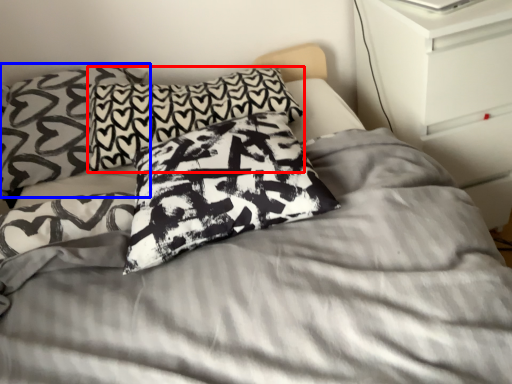
Question: Which point is further to the camera, pillow (highlighted by a red box) or pillow (highlighted by a blue box)?

Choices:
 (A) pillow
 (B) pillow

Answer: (A)